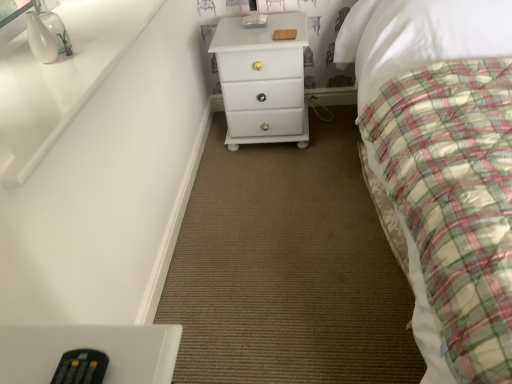
The width and height of the screenshot is (512, 384). Describe the element at coordinates (418, 36) in the screenshot. I see `plaid fabric bed at right` at that location.

The width and height of the screenshot is (512, 384). In order to click on white glossy chest of drawers at center in this screenshot , I will do `click(262, 80)`.

Where is `remote that is above the plaid fabric bed at right (from a real-world perspective)`? This screenshot has width=512, height=384. remote that is above the plaid fabric bed at right (from a real-world perspective) is located at coordinates (81, 367).

Does plaid fabric bed at right appear on the right side of black plastic remote at lower left?

Indeed, plaid fabric bed at right is positioned on the right side of black plastic remote at lower left.

From the image's perspective, is plaid fabric bed at right above or below black plastic remote at lower left?

Clearly, from the image's perspective, plaid fabric bed at right is above black plastic remote at lower left.

Is plaid fabric bed at right shorter than black plastic remote at lower left?

No, plaid fabric bed at right is not shorter than black plastic remote at lower left.

Who is smaller, white glossy chest of drawers at center or plaid fabric bed at right?

With smaller size is white glossy chest of drawers at center.

From a real-world perspective, between white glossy chest of drawers at center and plaid fabric bed at right, who is vertically lower?

white glossy chest of drawers at center, from a real-world perspective.

Locate an element on the screen. The width and height of the screenshot is (512, 384). bed above the white glossy chest of drawers at center (from a real-world perspective) is located at coordinates (418, 36).

Where is `bed that is under the black plastic remote at lower left (from a real-world perspective)`? bed that is under the black plastic remote at lower left (from a real-world perspective) is located at coordinates point(418,36).

Considering the points (87, 368) and (453, 24), which point is in front, point (87, 368) or point (453, 24)?

The point (87, 368) is closer to the camera.

From the picture: Is there a large distance between black plastic remote at lower left and plaid fabric bed at right?

That's right, there is a large distance between black plastic remote at lower left and plaid fabric bed at right.

Would you say black plastic remote at lower left contains plaid fabric bed at right?

No, plaid fabric bed at right is not surrounded by black plastic remote at lower left.

From a real-world perspective, is white glossy chest of drawers at center positioned over black plastic remote at lower left based on gravity?

No, from a real-world perspective, white glossy chest of drawers at center is not over black plastic remote at lower left

Is white glossy chest of drawers at center not inside black plastic remote at lower left?

Absolutely, white glossy chest of drawers at center is external to black plastic remote at lower left.

Considering the sizes of white glossy chest of drawers at center and black plastic remote at lower left in the image, is white glossy chest of drawers at center taller or shorter than black plastic remote at lower left?

In the image, white glossy chest of drawers at center appears to be taller than black plastic remote at lower left.

Is black plastic remote at lower left at the back of white glossy chest of drawers at center?

No, white glossy chest of drawers at center is not facing away from black plastic remote at lower left.

From a real-world perspective, is black plastic remote at lower left over white glossy chest of drawers at center?

Yes, from a real-world perspective, black plastic remote at lower left is on top of white glossy chest of drawers at center.

Would you say black plastic remote at lower left is to the left or to the right of white glossy chest of drawers at center in the picture?

black plastic remote at lower left is to the left of white glossy chest of drawers at center.

Identify the location of chest of drawers behind the black plastic remote at lower left. The height and width of the screenshot is (384, 512). (262, 80).

Who is bigger, black plastic remote at lower left or white glossy chest of drawers at center?

Bigger between the two is white glossy chest of drawers at center.

Could white glossy chest of drawers at center be considered to be inside plaid fabric bed at right?

No, white glossy chest of drawers at center is not surrounded by plaid fabric bed at right.

Between plaid fabric bed at right and white glossy chest of drawers at center, which one has larger width?

plaid fabric bed at right is wider.

From the image's perspective, does plaid fabric bed at right appear higher than white glossy chest of drawers at center?

Incorrect, from the image's perspective, plaid fabric bed at right is lower than white glossy chest of drawers at center.

This screenshot has height=384, width=512. What are the coordinates of `remote above the plaid fabric bed at right (from a real-world perspective)` in the screenshot? It's located at (81, 367).

The image size is (512, 384). I want to click on bed below the white glossy chest of drawers at center (from the image's perspective), so click(418, 36).

Considering their positions, is black plastic remote at lower left positioned closer to plaid fabric bed at right than white glossy chest of drawers at center?

The object closer to plaid fabric bed at right is white glossy chest of drawers at center.

Considering their positions, is black plastic remote at lower left positioned further to white glossy chest of drawers at center than plaid fabric bed at right?

black plastic remote at lower left lies further to white glossy chest of drawers at center than the other object.

Which object lies nearer to the anchor point white glossy chest of drawers at center, plaid fabric bed at right or black plastic remote at lower left?

plaid fabric bed at right is positioned closer to the anchor white glossy chest of drawers at center.

From the image, which object appears to be farther from black plastic remote at lower left, white glossy chest of drawers at center or plaid fabric bed at right?

white glossy chest of drawers at center.

In the scene shown: Considering their positions, is white glossy chest of drawers at center positioned further to plaid fabric bed at right than black plastic remote at lower left?

Among the two, black plastic remote at lower left is located further to plaid fabric bed at right.

Which object lies nearer to the anchor point black plastic remote at lower left, plaid fabric bed at right or white glossy chest of drawers at center?

plaid fabric bed at right.

At what (x,y) coordinates should I click in order to perform the action: click on remote between plaid fabric bed at right and white glossy chest of drawers at center along the z-axis. Please return your answer as a coordinate pair (x, y). Looking at the image, I should click on (81, 367).